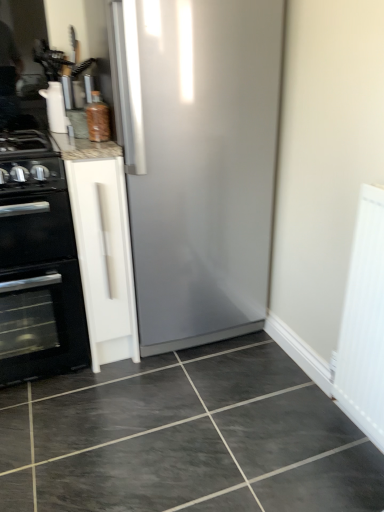
The image size is (384, 512). Describe the element at coordinates (29, 162) in the screenshot. I see `black matte gas stove at left` at that location.

The image size is (384, 512). What do you see at coordinates (364, 322) in the screenshot?
I see `white textured radiator at right` at bounding box center [364, 322].

Find the location of a particular element. white matte cabinet at left is located at coordinates (102, 246).

Could you tell me if white glossy paper towel dispenser at upper left is facing white matte cabinet at left?

No, white glossy paper towel dispenser at upper left is not aimed at white matte cabinet at left.

From the image's perspective, is white glossy paper towel dispenser at upper left on top of white matte cabinet at left?

Correct, white glossy paper towel dispenser at upper left appears higher than white matte cabinet at left in the image.

Would you consider white glossy paper towel dispenser at upper left to be distant from white matte cabinet at left?

No, white glossy paper towel dispenser at upper left is not far from white matte cabinet at left.

Consider the image. Considering the positions of objects black matte gas stove at left and dark gray glossy tile at center in the image provided, who is more to the left, black matte gas stove at left or dark gray glossy tile at center?

black matte gas stove at left is more to the left.

Who is more distant, black matte gas stove at left or dark gray glossy tile at center?

black matte gas stove at left.

Is dark gray glossy tile at center at the back of black matte gas stove at left?

No, dark gray glossy tile at center is not at the back of black matte gas stove at left.

Is dark gray glossy tile at center in contact with white glossy paper towel dispenser at upper left?

They are not placed beside each other.

From a real-world perspective, is dark gray glossy tile at center physically above white glossy paper towel dispenser at upper left?

No, from a real-world perspective, dark gray glossy tile at center is not over white glossy paper towel dispenser at upper left

Based on their sizes in the image, would you say dark gray glossy tile at center is bigger or smaller than white glossy paper towel dispenser at upper left?

In the image, dark gray glossy tile at center appears to be larger than white glossy paper towel dispenser at upper left.

Is dark gray glossy tile at center in front of or behind white glossy paper towel dispenser at upper left in the image?

In the image, dark gray glossy tile at center appears in front of white glossy paper towel dispenser at upper left.

Is dark gray glossy tile at center further to the viewer compared to black matte oven at left?

No.

Considering the relative sizes of dark gray glossy tile at center and black matte oven at left in the image provided, is dark gray glossy tile at center shorter than black matte oven at left?

Yes, dark gray glossy tile at center is shorter than black matte oven at left.

Would you say dark gray glossy tile at center is a long distance from black matte oven at left?

No, dark gray glossy tile at center is not far from black matte oven at left.

From a real-world perspective, who is located lower, dark gray glossy tile at center or black matte oven at left?

dark gray glossy tile at center, from a real-world perspective.

Consider the image. Considering the relative sizes of black matte gas stove at left and white textured radiator at right in the image provided, is black matte gas stove at left wider than white textured radiator at right?

Indeed, black matte gas stove at left has a greater width compared to white textured radiator at right.

From the image's perspective, does black matte gas stove at left appear lower than white textured radiator at right?

Incorrect, from the image's perspective, black matte gas stove at left is higher than white textured radiator at right.

Choose the correct answer: Is black matte gas stove at left inside white textured radiator at right or outside it?

black matte gas stove at left is located beyond the bounds of white textured radiator at right.

Is black matte gas stove at left facing away from white textured radiator at right?

No, white textured radiator at right is not at the back of black matte gas stove at left.

Considering the positions of objects black matte oven at left and white textured radiator at right in the image provided, who is more to the left, black matte oven at left or white textured radiator at right?

black matte oven at left is more to the left.

From a real-world perspective, is black matte oven at left located higher than white textured radiator at right?

No, from a real-world perspective, black matte oven at left is not above white textured radiator at right.

The height and width of the screenshot is (512, 384). I want to click on oven below the white textured radiator at right (from a real-world perspective), so click(x=37, y=264).

Is black matte oven at left thinner than white textured radiator at right?

No, black matte oven at left is not thinner than white textured radiator at right.

Is white textured radiator at right beside dark gray glossy tile at center?

No.

Considering the relative positions of white textured radiator at right and dark gray glossy tile at center in the image provided, is white textured radiator at right to the left or to the right of dark gray glossy tile at center?

white textured radiator at right is positioned on dark gray glossy tile at center's right side.

How many degrees apart are the facing directions of white textured radiator at right and dark gray glossy tile at center?

179 degrees separate the facing orientations of white textured radiator at right and dark gray glossy tile at center.

Is white textured radiator at right bigger than dark gray glossy tile at center?

Incorrect, white textured radiator at right is not larger than dark gray glossy tile at center.

This screenshot has height=512, width=384. What are the coordinates of `appliance above the white matte cabinet at left (from a real-world perspective)` in the screenshot? It's located at (55, 106).

Identify the location of gas stove behind the dark gray glossy tile at center. The height and width of the screenshot is (512, 384). (29, 162).

Looking at the image, which one is located closer to dark gray glossy tile at center, white glossy paper towel dispenser at upper left or black matte oven at left?

The object closer to dark gray glossy tile at center is black matte oven at left.

Estimate the real-world distances between objects in this image. Which object is closer to dark gray glossy tile at center, black matte oven at left or white textured radiator at right?

black matte oven at left is positioned closer to the anchor dark gray glossy tile at center.

From the picture: Which object lies nearer to the anchor point black matte oven at left, white textured radiator at right or white matte cabinet at left?

white matte cabinet at left.

Considering their positions, is white textured radiator at right positioned further to white glossy paper towel dispenser at upper left than black matte gas stove at left?

white textured radiator at right lies further to white glossy paper towel dispenser at upper left than the other object.

When comparing their distances from white glossy paper towel dispenser at upper left, does black matte gas stove at left or black matte oven at left seem further?

black matte oven at left is further to white glossy paper towel dispenser at upper left.

Looking at this image, which object lies nearer to the anchor point black matte oven at left, black matte gas stove at left or white matte cabinet at left?

The object closer to black matte oven at left is white matte cabinet at left.

From the image, which object appears to be farther from black matte gas stove at left, black matte oven at left or dark gray glossy tile at center?

Based on the image, dark gray glossy tile at center appears to be further to black matte gas stove at left.

When comparing their distances from dark gray glossy tile at center, does white textured radiator at right or black matte oven at left seem closer?

black matte oven at left is positioned closer to the anchor dark gray glossy tile at center.

Find the location of a particular element. cabinetry between white glossy paper towel dispenser at upper left and black matte oven at left from top to bottom is located at coordinates (102, 246).

Locate an element on the screen. gas stove between white glossy paper towel dispenser at upper left and dark gray glossy tile at center in the vertical direction is located at coordinates (29, 162).

The width and height of the screenshot is (384, 512). In order to click on ceramic tile between black matte gas stove at left and white textured radiator at right in this screenshot , I will do `click(186, 438)`.

Where is `appliance located between black matte gas stove at left and white textured radiator at right in the left-right direction`? appliance located between black matte gas stove at left and white textured radiator at right in the left-right direction is located at coordinates [55, 106].